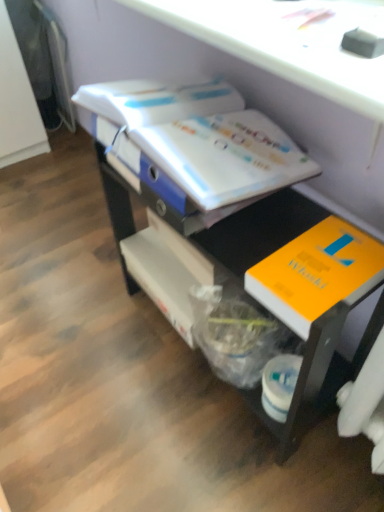
Locate an element on the screen. matte black drawer at center is located at coordinates (293, 288).

From the image's perspective, between white glossy book at upper center, which ranks as the first book in top-to-bottom order, and matte black drawer at center, who is located below?

matte black drawer at center is shown below in the image.

Looking at this image, choose the correct answer: Is white glossy book at upper center, the 2th book ordered from the bottom, inside matte black drawer at center or outside it?

white glossy book at upper center, the 2th book ordered from the bottom, exists entirely within matte black drawer at center.

I want to click on desk below the white glossy book at upper center, which ranks as the first book in top-to-bottom order (from a real-world perspective), so click(x=293, y=288).

From the picture: From a real-world perspective, which is physically above, white glossy book at upper center, which ranks as the first book in top-to-bottom order, or matte black drawer at center?

white glossy book at upper center, which ranks as the first book in top-to-bottom order.

Between matte black drawer at center and white glossy book at upper center, the 2th book ordered from the bottom, which one has more height?

With more height is matte black drawer at center.

Based on the photo, is matte black drawer at center far away from white glossy book at upper center, which ranks as the first book in top-to-bottom order?

They are positioned close to each other.

Where is `the 2nd book behind the matte black drawer at center`? The width and height of the screenshot is (384, 512). the 2nd book behind the matte black drawer at center is located at coordinates (200, 138).

Would you say matte black drawer at center is inside or outside white glossy book at upper center, which ranks as the first book in top-to-bottom order?

matte black drawer at center is not inside white glossy book at upper center, which ranks as the first book in top-to-bottom order, it's outside.

Between orange matte book at lower right, acting as the first book starting from the bottom, and white glossy book at upper center, which ranks as the first book in top-to-bottom order, which one has larger size?

Bigger between the two is white glossy book at upper center, which ranks as the first book in top-to-bottom order.

Which is more to the left, orange matte book at lower right, marked as the 2th book in a top-to-bottom arrangement, or white glossy book at upper center, which ranks as the first book in top-to-bottom order?

Positioned to the left is white glossy book at upper center, which ranks as the first book in top-to-bottom order.

Between point (370, 257) and point (249, 157), which one is positioned behind?

The point (249, 157) is behind.

From the image's perspective, between orange matte book at lower right, marked as the 2th book in a top-to-bottom arrangement, and white glossy book at upper center, which ranks as the first book in top-to-bottom order, who is located below?

orange matte book at lower right, marked as the 2th book in a top-to-bottom arrangement, appears lower in the image.

From the image's perspective, which object appears higher, orange matte book at lower right, marked as the 2th book in a top-to-bottom arrangement, or matte black drawer at center?

orange matte book at lower right, marked as the 2th book in a top-to-bottom arrangement, appears higher in the image.

Between orange matte book at lower right, marked as the 2th book in a top-to-bottom arrangement, and matte black drawer at center, which one has larger size?

matte black drawer at center.

Is matte black drawer at center at the back of orange matte book at lower right, acting as the first book starting from the bottom?

Yes, matte black drawer at center is at the back of orange matte book at lower right, acting as the first book starting from the bottom.

Considering the sizes of objects white glossy book at upper center, which ranks as the first book in top-to-bottom order, and orange matte book at lower right, marked as the 2th book in a top-to-bottom arrangement, in the image provided, who is thinner, white glossy book at upper center, which ranks as the first book in top-to-bottom order, or orange matte book at lower right, marked as the 2th book in a top-to-bottom arrangement,?

orange matte book at lower right, marked as the 2th book in a top-to-bottom arrangement.

In the scene shown: Is white glossy book at upper center, which ranks as the first book in top-to-bottom order, at the right side of orange matte book at lower right, marked as the 2th book in a top-to-bottom arrangement?

In fact, white glossy book at upper center, which ranks as the first book in top-to-bottom order, is to the left of orange matte book at lower right, marked as the 2th book in a top-to-bottom arrangement.

From the image's perspective, is white glossy book at upper center, which ranks as the first book in top-to-bottom order, positioned above or below orange matte book at lower right, acting as the first book starting from the bottom?

Clearly, from the image's perspective, white glossy book at upper center, which ranks as the first book in top-to-bottom order, is above orange matte book at lower right, acting as the first book starting from the bottom.

Considering the positions of points (214, 248) and (305, 324), is point (214, 248) closer to camera compared to point (305, 324)?

No, it is behind (305, 324).

From a real-world perspective, is matte black drawer at center on orange matte book at lower right, acting as the first book starting from the bottom?

Incorrect, from a real-world perspective, matte black drawer at center is lower than orange matte book at lower right, acting as the first book starting from the bottom.

Locate an element on the screen. Image resolution: width=384 pixels, height=512 pixels. book on the right of the matte black drawer at center is located at coordinates (317, 273).

Between matte black drawer at center and orange matte book at lower right, marked as the 2th book in a top-to-bottom arrangement, which one has larger width?

matte black drawer at center is wider.

You are a GUI agent. You are given a task and a screenshot of the screen. Output one action in this format:
    pyautogui.click(x=<x>, y=<y>)
    Task: Click on the desk below the white glossy book at upper center, the 2th book ordered from the bottom (from the image's perspective)
    Image resolution: width=384 pixels, height=512 pixels.
    Given the screenshot: What is the action you would take?
    [293, 288]

Where is `the 2nd book behind the matte black drawer at center`? the 2nd book behind the matte black drawer at center is located at coordinates (200, 138).

From the image, which object appears to be farther from matte black drawer at center, orange matte book at lower right, marked as the 2th book in a top-to-bottom arrangement, or white glossy book at upper center, which ranks as the first book in top-to-bottom order?

white glossy book at upper center, which ranks as the first book in top-to-bottom order, lies further to matte black drawer at center than the other object.

Looking at the image, which one is located further to matte black drawer at center, white glossy book at upper center, which ranks as the first book in top-to-bottom order, or orange matte book at lower right, marked as the 2th book in a top-to-bottom arrangement?

white glossy book at upper center, which ranks as the first book in top-to-bottom order, is further to matte black drawer at center.

Estimate the real-world distances between objects in this image. Which object is closer to white glossy book at upper center, the 2th book ordered from the bottom, orange matte book at lower right, acting as the first book starting from the bottom, or matte black drawer at center?

matte black drawer at center lies closer to white glossy book at upper center, the 2th book ordered from the bottom, than the other object.

Considering their positions, is white glossy book at upper center, which ranks as the first book in top-to-bottom order, positioned further to orange matte book at lower right, marked as the 2th book in a top-to-bottom arrangement, than matte black drawer at center?

white glossy book at upper center, which ranks as the first book in top-to-bottom order, is further to orange matte book at lower right, marked as the 2th book in a top-to-bottom arrangement.

Estimate the real-world distances between objects in this image. Which object is closer to orange matte book at lower right, acting as the first book starting from the bottom, matte black drawer at center or white glossy book at upper center, which ranks as the first book in top-to-bottom order?

The object closer to orange matte book at lower right, acting as the first book starting from the bottom, is matte black drawer at center.

Estimate the real-world distances between objects in this image. Which object is closer to white glossy book at upper center, which ranks as the first book in top-to-bottom order, matte black drawer at center or orange matte book at lower right, marked as the 2th book in a top-to-bottom arrangement?

Based on the image, matte black drawer at center appears to be nearer to white glossy book at upper center, which ranks as the first book in top-to-bottom order.

The width and height of the screenshot is (384, 512). In order to click on book between white glossy book at upper center, which ranks as the first book in top-to-bottom order, and matte black drawer at center vertically in this screenshot , I will do `click(317, 273)`.